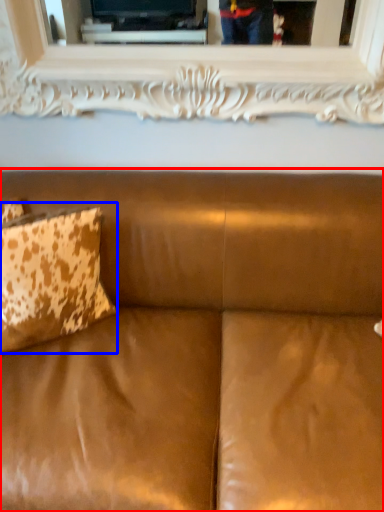
Question: Which object is further to the camera taking this photo, studio couch (highlighted by a red box) or pillow (highlighted by a blue box)?

Choices:
 (A) studio couch
 (B) pillow

Answer: (B)